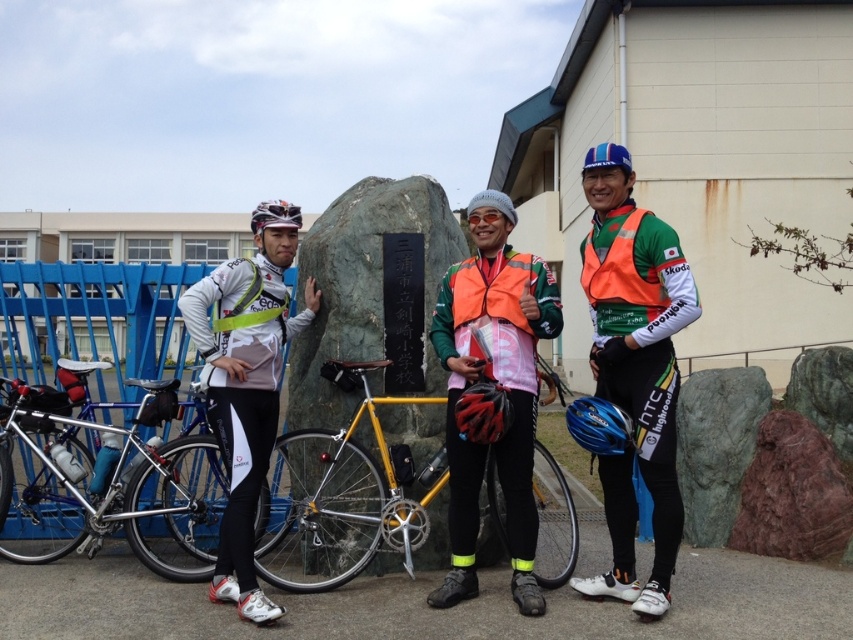
You are a photographer trying to capture a photo of the silver metallic bicycle at left and the black matte bicycle helmet at center. Since you want to include both in the frame, which object should you position closer to the camera to ensure both are visible?

To include both the silver metallic bicycle at left and the black matte bicycle helmet at center in the frame, you should position the silver metallic bicycle at left closer to the camera. Since it is on the left side of the black matte bicycle helmet at center, moving it forward will allow both objects to be visible without one blocking the other.

You are a cyclist who wants to park your bicycle near the silver metallic bicycle at left. According to the image, where exactly should you place your bicycle?

The silver metallic bicycle at left is located at point (x=111, y=477), so you should place your bicycle near that coordinate.